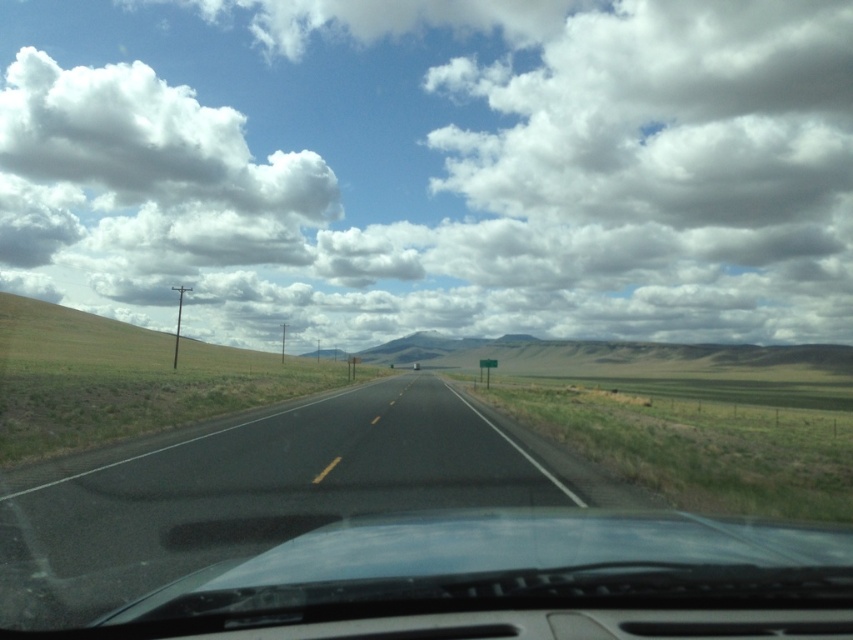
You are driving a car and see the point at coordinates (248, 492) in the image. Is this point located on the black asphalt highway at the center of the road?

Yes, the point at coordinates (248, 492) is on the black asphalt highway at center, so the point is located on the highway.

You are driving along the open road and notice two points marked on the road ahead. The first point is located at coordinates point (665, 58) and the second at point (612, 534). Which point is closer to your current position?

Point (665, 58) is closer to your current position because it is further to the viewer than point (612, 534).

You are a drone operator preparing to fly a drone with a 1.5 meter wingspan. You look at the image and see the white fluffy cloud at upper center and the black asphalt highway at center. Which object is larger in the image?

The white fluffy cloud at upper center is bigger than the black asphalt highway at center, so the white fluffy cloud at upper center is larger in the image.